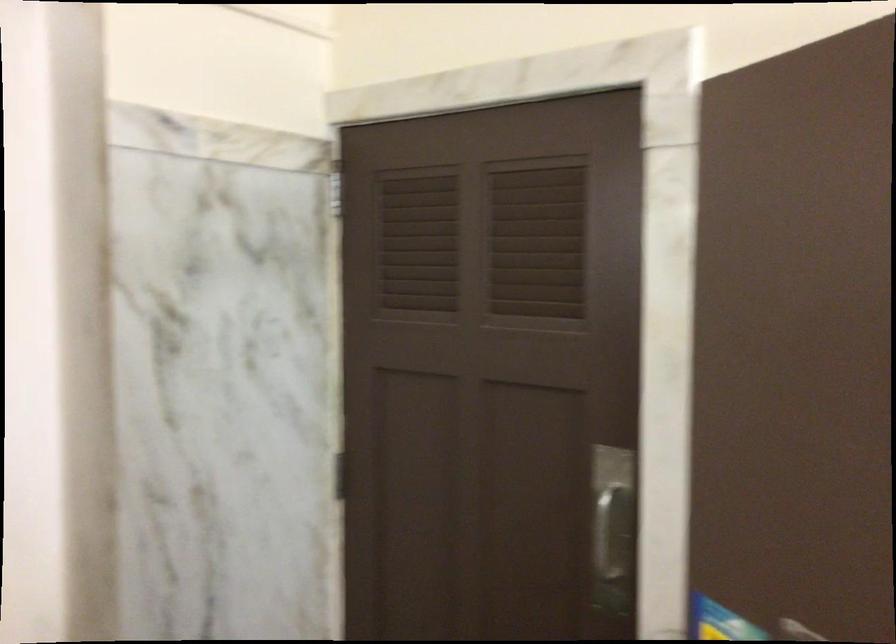
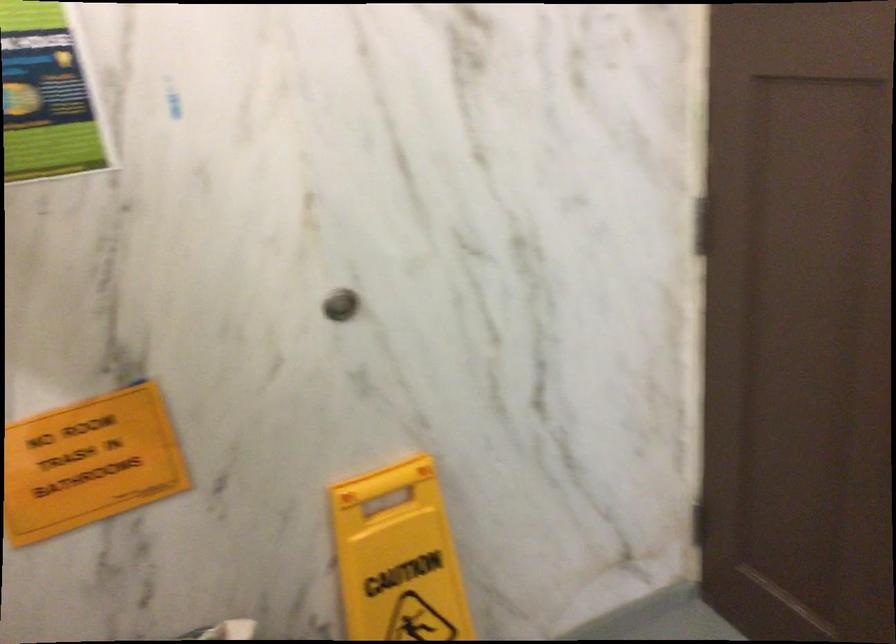
The first image is from the beginning of the video and the second image is from the end. How did the camera likely rotate when shooting the video?

The camera's rotation is toward left-down.